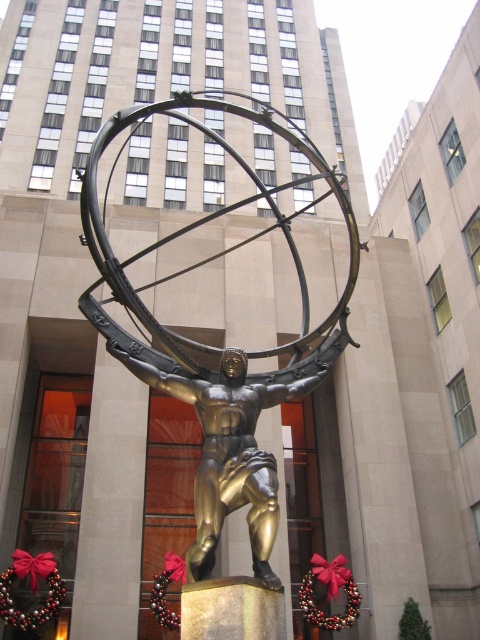
Question: Which point is closer to the camera taking this photo?

Choices:
 (A) (218, 419)
 (B) (156, 328)

Answer: (A)

Question: Does gold polished statue at center appear on the left side of gold metallic statue at center?

Choices:
 (A) no
 (B) yes

Answer: (B)

Question: Can you confirm if gold polished statue at center is positioned to the right of gold metallic statue at center?

Choices:
 (A) no
 (B) yes

Answer: (A)

Question: Is gold polished statue at center to the left of gold metallic statue at center from the viewer's perspective?

Choices:
 (A) no
 (B) yes

Answer: (B)